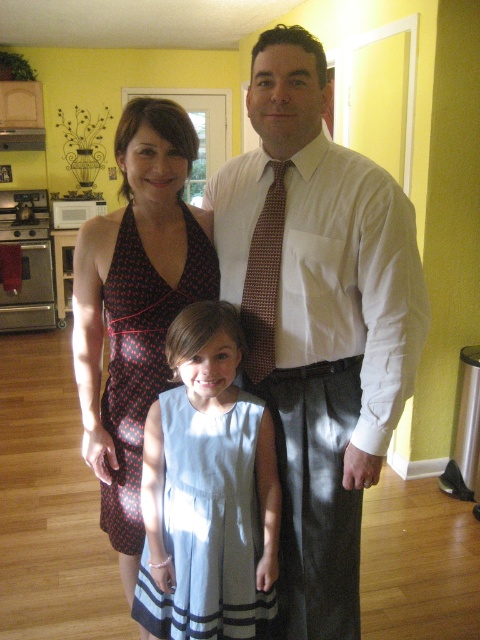
Who is shorter, light blue cotton dress at center or light blue fabric dress at center?

light blue cotton dress at center

Which is more to the left, light blue cotton dress at center or light blue fabric dress at center?

light blue fabric dress at center is more to the left.

Measure the distance between light blue cotton dress at center and camera.

light blue cotton dress at center and camera are 4.52 feet apart.

Locate an element on the screen. light blue cotton dress at center is located at coordinates (206, 490).

Can you confirm if white textured shirt at center is positioned to the right of light blue cotton dress at center?

Indeed, white textured shirt at center is positioned on the right side of light blue cotton dress at center.

Identify the location of white textured shirt at center. The image size is (480, 640). (317, 320).

What do you see at coordinates (317, 320) in the screenshot?
I see `white textured shirt at center` at bounding box center [317, 320].

Who is shorter, white textured shirt at center or brown dotted tie at center?

brown dotted tie at center

In order to click on white textured shirt at center in this screenshot , I will do `click(317, 320)`.

The image size is (480, 640). Identify the location of white textured shirt at center. (317, 320).